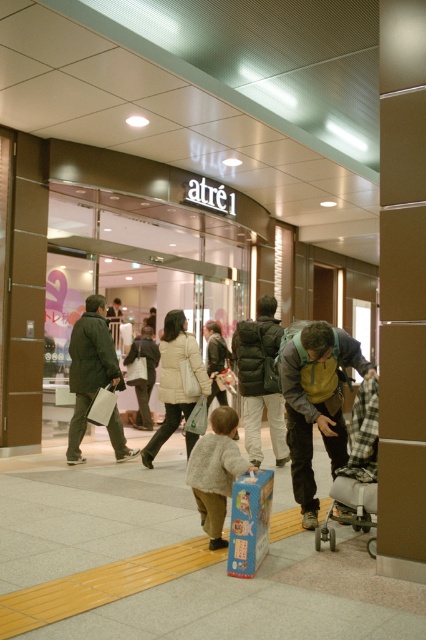
You are a delivery robot with a 1.5 meter wide package. You need to navigate between the yellow backpack at lower right and the matte black puffer jacket at center. Can you fit through the space between them?

The distance between the yellow backpack at lower right and the matte black puffer jacket at center is 1.66 meters. Since your package is 1.5 meters wide, you can fit through the space between them as there is enough clearance.

You are a delivery robot with a 30 inch wide package that needs to navigate through the entrance of the store. Based on the distance between the dark green jacket at left and the beige puffy coat at center, can you safely pass through the entrance without hitting either person?

The distance between the dark green jacket at left and the beige puffy coat at center is 28.77 inches. Since the package is 30 inches wide, it is slightly wider than the available space. The robot should wait for the people to move further apart before attempting to pass through the entrance.

You are a store employee standing at the entrance of the store. You need to hand out a promotional flyer to the taller person between the dark green jacket at left and the beige puffy coat at center. Which person should you approach?

The dark green jacket at left is taller than the beige puffy coat at center, so you should approach the person wearing the dark green jacket at left.